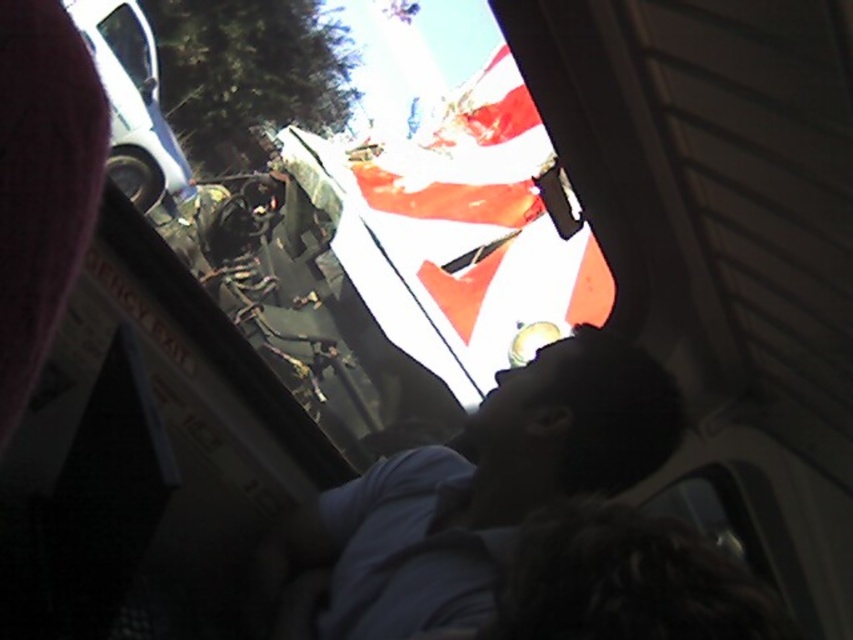
Question: Which object appears closest to the camera in this image?

Choices:
 (A) transparent glass bus window at upper left
 (B) dark blue shirt at center

Answer: (B)

Question: Observing the image, what is the correct spatial positioning of dark blue shirt at center in reference to transparent glass bus window at upper left?

Choices:
 (A) above
 (B) below

Answer: (B)

Question: Which point is farther to the camera?

Choices:
 (A) transparent glass bus window at upper left
 (B) dark blue shirt at center

Answer: (A)

Question: Which of the following is the farthest from the observer?

Choices:
 (A) dark blue shirt at center
 (B) transparent glass bus window at upper left

Answer: (B)

Question: Is dark blue shirt at center smaller than transparent glass bus window at upper left?

Choices:
 (A) yes
 (B) no

Answer: (B)

Question: Can you confirm if dark blue shirt at center is smaller than transparent glass bus window at upper left?

Choices:
 (A) no
 (B) yes

Answer: (A)